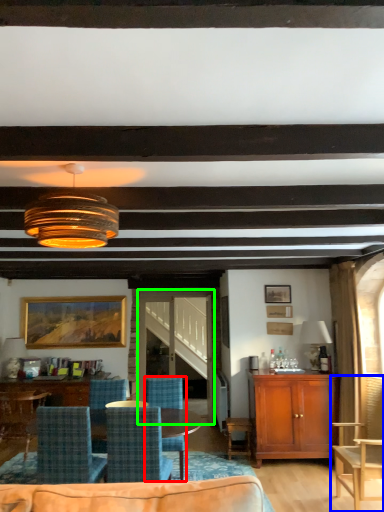
Question: Which is farther away from chair (highlighted by a red box)? chair (highlighted by a blue box) or glass door (highlighted by a green box)?

Choices:
 (A) chair
 (B) glass door

Answer: (A)